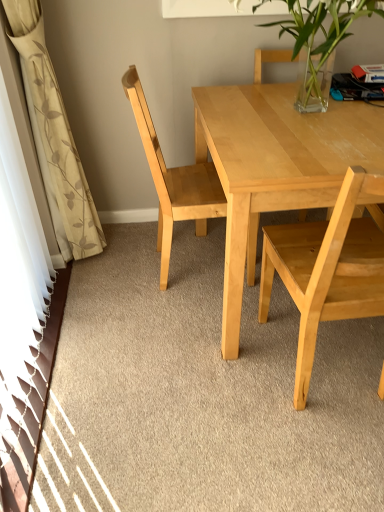
What do you see at coordinates (322, 34) in the screenshot? This screenshot has height=512, width=384. I see `clear glass vase at upper center` at bounding box center [322, 34].

You are a GUI agent. You are given a task and a screenshot of the screen. Output one action in this format:
    pyautogui.click(x=<x>, y=<y>)
    Task: Click on the white floral fabric curtain at left
    The height and width of the screenshot is (512, 384).
    Given the screenshot: What is the action you would take?
    pyautogui.click(x=54, y=133)

Describe the element at coordinates (326, 270) in the screenshot. I see `light wood chair at right, which appears as the second chair when viewed from the left` at that location.

Describe the element at coordinates (175, 179) in the screenshot. I see `light wood chair at center, the first chair from the left` at that location.

Find the location of a particular element. clear glass vase at upper center is located at coordinates (322, 34).

From the picture: In terms of width, does light wood table at center look wider or thinner when compared to light wood chair at center, placed as the 2th chair when sorted from right to left?

Considering their sizes, light wood table at center looks broader than light wood chair at center, placed as the 2th chair when sorted from right to left.

What's the angular difference between light wood table at center and light wood chair at center, placed as the 2th chair when sorted from right to left,'s facing directions?

The facing directions of light wood table at center and light wood chair at center, placed as the 2th chair when sorted from right to left, are 88.8 degrees apart.

From the picture: From a real-world perspective, is light wood table at center under light wood chair at center, the first chair from the left?

Yes.

How far apart are light wood table at center and light wood chair at center, the first chair from the left?

light wood table at center is 14.78 inches from light wood chair at center, the first chair from the left.

From the picture: Which of these two, light wood chair at right, marked as the 1th chair in a right-to-left arrangement, or light wood table at center, stands taller?

light wood chair at right, marked as the 1th chair in a right-to-left arrangement.

From the image's perspective, which one is positioned higher, light wood chair at right, which appears as the second chair when viewed from the left, or light wood table at center?

From the image's view, light wood table at center is above.

Which object is thinner, light wood chair at right, which appears as the second chair when viewed from the left, or light wood table at center?

With smaller width is light wood chair at right, which appears as the second chair when viewed from the left.

Does light wood chair at right, marked as the 1th chair in a right-to-left arrangement, have a larger size compared to light wood table at center?

No, light wood chair at right, marked as the 1th chair in a right-to-left arrangement, is not bigger than light wood table at center.

From the image's perspective, is light wood chair at center, placed as the 2th chair when sorted from right to left, below light wood chair at right, which appears as the second chair when viewed from the left?

No.

Consider the image. Considering the sizes of objects light wood chair at center, the first chair from the left, and light wood chair at right, which appears as the second chair when viewed from the left, in the image provided, who is smaller, light wood chair at center, the first chair from the left, or light wood chair at right, which appears as the second chair when viewed from the left,?

With smaller size is light wood chair at center, the first chair from the left.

Considering the sizes of objects light wood chair at center, placed as the 2th chair when sorted from right to left, and light wood chair at right, which appears as the second chair when viewed from the left, in the image provided, who is shorter, light wood chair at center, placed as the 2th chair when sorted from right to left, or light wood chair at right, which appears as the second chair when viewed from the left,?

With less height is light wood chair at right, which appears as the second chair when viewed from the left.

How much distance is there between light wood chair at center, the first chair from the left, and light wood chair at right, marked as the 1th chair in a right-to-left arrangement?

light wood chair at center, the first chair from the left, is 20.38 inches away from light wood chair at right, marked as the 1th chair in a right-to-left arrangement.

You are a GUI agent. You are given a task and a screenshot of the screen. Output one action in this format:
    pyautogui.click(x=<x>, y=<y>)
    Task: Click on the coffee table to the right of clear glass vase at upper center
    
    Given the screenshot: What is the action you would take?
    pyautogui.click(x=275, y=166)

Does light wood table at center have a larger size compared to clear glass vase at upper center?

Yes.

From the image's perspective, which one is positioned lower, light wood table at center or clear glass vase at upper center?

light wood table at center is shown below in the image.

From a real-world perspective, who is located higher, light wood table at center or clear glass vase at upper center?

In real-world perspective, clear glass vase at upper center is above.

From a real-world perspective, who is located lower, light wood chair at right, which appears as the second chair when viewed from the left, or clear glass vase at upper center?

In real-world perspective, light wood chair at right, which appears as the second chair when viewed from the left, is lower.

Are light wood chair at right, marked as the 1th chair in a right-to-left arrangement, and clear glass vase at upper center far apart?

No, light wood chair at right, marked as the 1th chair in a right-to-left arrangement, is not far from clear glass vase at upper center.

Is light wood chair at right, marked as the 1th chair in a right-to-left arrangement, oriented towards clear glass vase at upper center?

Yes.

Is point (289, 234) closer to camera compared to point (310, 77)?

Yes, it is in front of point (310, 77).

Choose the correct answer: Is white floral fabric curtain at left inside light wood chair at right, which appears as the second chair when viewed from the left, or outside it?

white floral fabric curtain at left is not enclosed by light wood chair at right, which appears as the second chair when viewed from the left.

From a real-world perspective, is white floral fabric curtain at left physically located above or below light wood chair at right, which appears as the second chair when viewed from the left?

From a real-world perspective, white floral fabric curtain at left is physically above light wood chair at right, which appears as the second chair when viewed from the left.

Is white floral fabric curtain at left next to light wood chair at right, marked as the 1th chair in a right-to-left arrangement, and touching it?

No, white floral fabric curtain at left is not beside light wood chair at right, marked as the 1th chair in a right-to-left arrangement.

Could you tell me if white floral fabric curtain at left is facing light wood chair at right, which appears as the second chair when viewed from the left?

No, white floral fabric curtain at left is not aimed at light wood chair at right, which appears as the second chair when viewed from the left.

Based on the photo, which object is positioned more to the right, clear glass vase at upper center or light wood table at center?

From the viewer's perspective, light wood table at center appears more on the right side.

What's the angular difference between clear glass vase at upper center and light wood table at center's facing directions?

There is a 0.822-degree angle between the facing directions of clear glass vase at upper center and light wood table at center.

In order to click on coffee table below the clear glass vase at upper center (from a real-world perspective) in this screenshot , I will do `click(275, 166)`.

Can you see clear glass vase at upper center touching light wood table at center?

No, clear glass vase at upper center is not with light wood table at center.

The image size is (384, 512). Identify the location of chair located behind the light wood table at center. (175, 179).

In order to click on chair in front of the light wood table at center in this screenshot , I will do `click(326, 270)`.

When comparing their distances from white floral fabric curtain at left, does light wood chair at center, placed as the 2th chair when sorted from right to left, or light wood table at center seem closer?

light wood chair at center, placed as the 2th chair when sorted from right to left, lies closer to white floral fabric curtain at left than the other object.

Considering their positions, is light wood chair at right, which appears as the second chair when viewed from the left, positioned further to light wood chair at center, the first chair from the left, than light wood table at center?

light wood chair at right, which appears as the second chair when viewed from the left.

Looking at the image, which one is located closer to light wood chair at center, placed as the 2th chair when sorted from right to left, clear glass vase at upper center or white floral fabric curtain at left?

Based on the image, white floral fabric curtain at left appears to be nearer to light wood chair at center, placed as the 2th chair when sorted from right to left.

Considering their positions, is white floral fabric curtain at left positioned further to light wood chair at right, which appears as the second chair when viewed from the left, than clear glass vase at upper center?

white floral fabric curtain at left is further to light wood chair at right, which appears as the second chair when viewed from the left.

Looking at this image, which object lies nearer to the anchor point light wood table at center, white floral fabric curtain at left or clear glass vase at upper center?

clear glass vase at upper center.

Based on their spatial positions, is light wood table at center or clear glass vase at upper center further from white floral fabric curtain at left?

Based on the image, clear glass vase at upper center appears to be further to white floral fabric curtain at left.

Estimate the real-world distances between objects in this image. Which object is closer to clear glass vase at upper center, light wood chair at center, placed as the 2th chair when sorted from right to left, or white floral fabric curtain at left?

Among the two, light wood chair at center, placed as the 2th chair when sorted from right to left, is located nearer to clear glass vase at upper center.

Estimate the real-world distances between objects in this image. Which object is closer to light wood chair at right, marked as the 1th chair in a right-to-left arrangement, light wood table at center or light wood chair at center, placed as the 2th chair when sorted from right to left?

light wood table at center lies closer to light wood chair at right, marked as the 1th chair in a right-to-left arrangement, than the other object.

Where is `chair between clear glass vase at upper center and light wood table at center from top to bottom`? chair between clear glass vase at upper center and light wood table at center from top to bottom is located at coordinates (175, 179).

Locate an element on the screen. chair situated between white floral fabric curtain at left and light wood chair at right, which appears as the second chair when viewed from the left, from left to right is located at coordinates (175, 179).

Identify the location of chair between light wood chair at center, placed as the 2th chair when sorted from right to left, and light wood table at center from left to right. The width and height of the screenshot is (384, 512). (326, 270).

In order to click on coffee table between clear glass vase at upper center and light wood chair at right, which appears as the second chair when viewed from the left, vertically in this screenshot , I will do `click(275, 166)`.